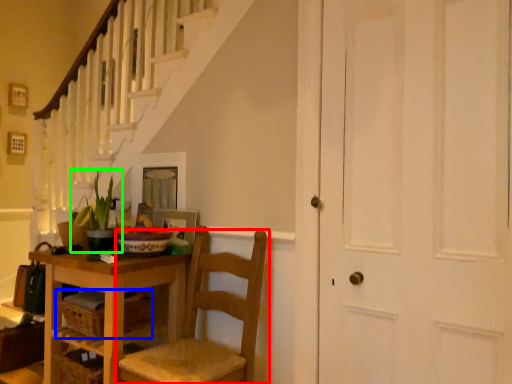
Question: Which object is the farthest from chair (highlighted by a red box)? Choose among these: drawer (highlighted by a blue box) or houseplant (highlighted by a green box).

Choices:
 (A) drawer
 (B) houseplant

Answer: (B)